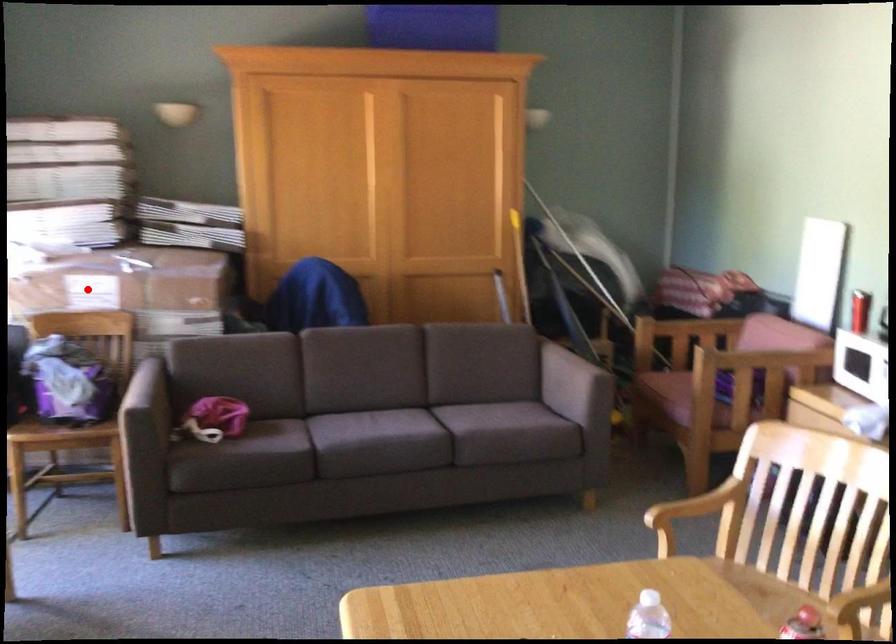
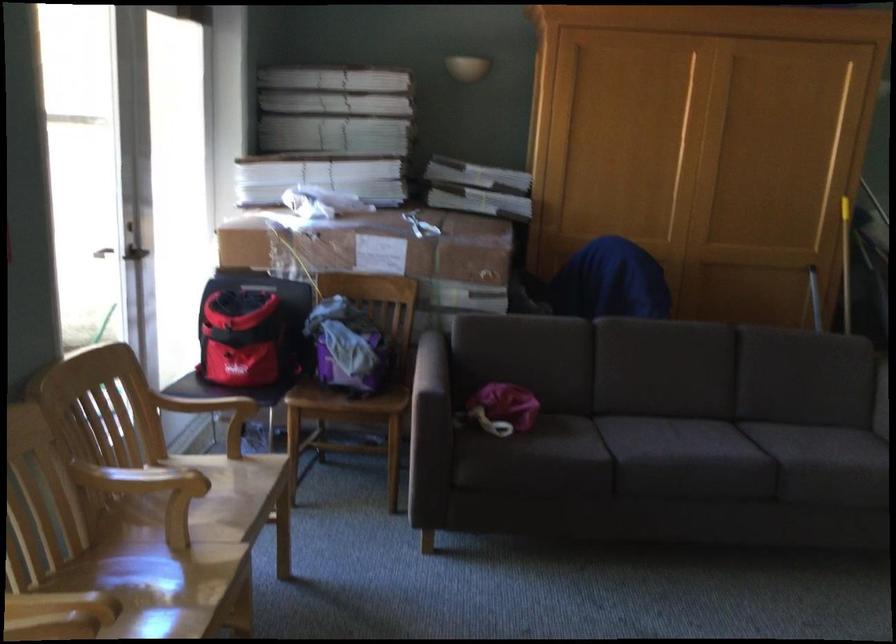
Locate, in the second image, the point that corresponds to the highlighted location in the first image.

(371, 245)